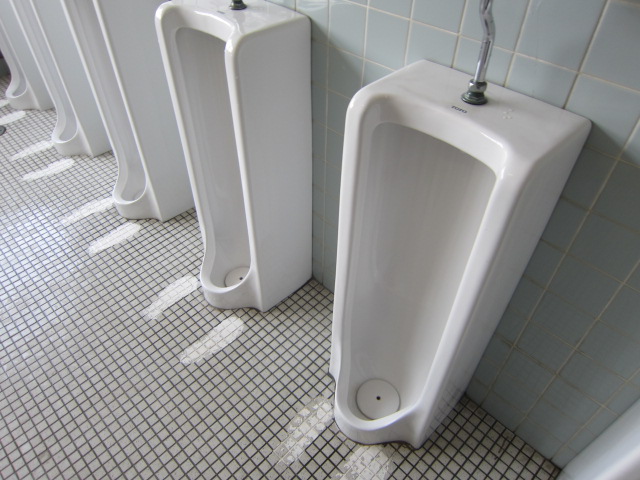
The image size is (640, 480). What are the coordinates of `urinals` in the screenshot? It's located at (406, 351), (271, 147), (136, 78), (52, 34), (11, 48), (621, 461).